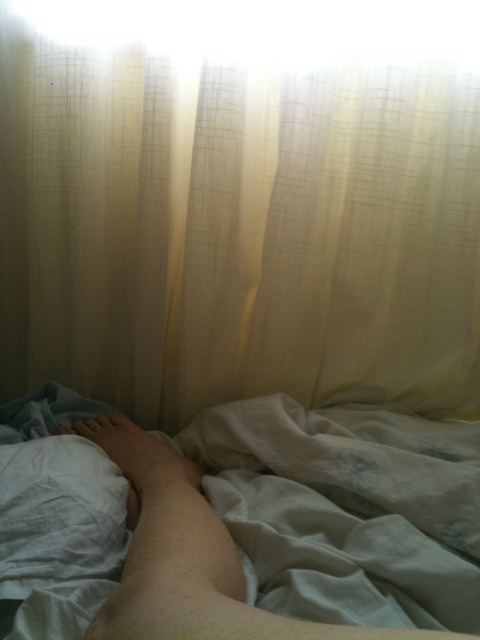
You are a photographer adjusting the focus on your camera. You have two points to focus on in the image, point (156, 404) and point (106, 611). Which point should you focus on first if you want to start with the one closer to the camera?

Point (106, 611) should be focused on first because it is closer to the camera than point (156, 404).

You are a photographer setting up a shoot in this room. You need to position a small lamp so that it illuminates the skinny white leg at lower left without casting a shadow on the white sheer curtain at upper center. Given their height difference, where should you place the lamp relative to the two objects?

Since the white sheer curtain at upper center is much taller than the skinny white leg at lower left, you should place the lamp below the level of the skinny white leg at lower left. This way, the light will hit the leg from below and avoid casting a shadow on the taller curtain above.